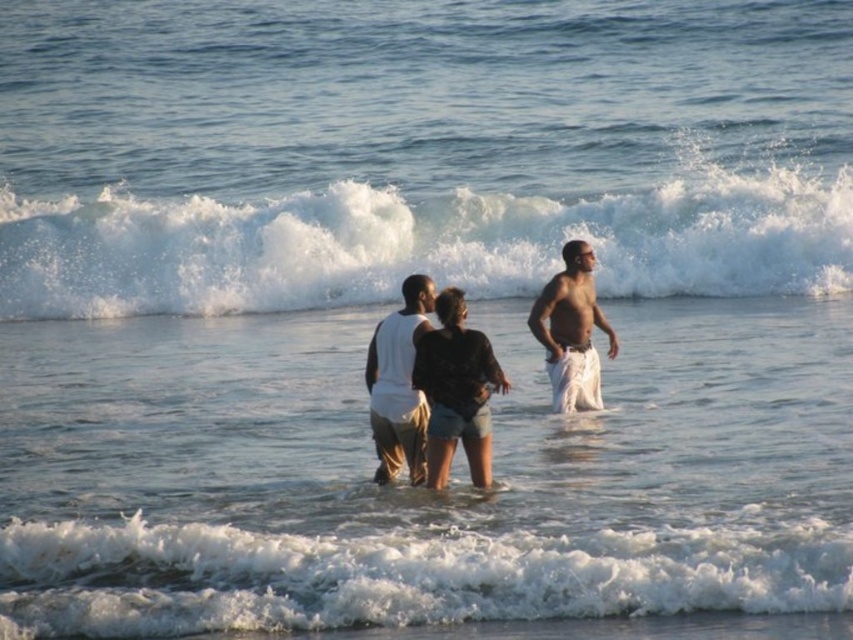
Is white frothy wave at lower center bigger than dark gray denim shorts at center?

Indeed, white frothy wave at lower center has a larger size compared to dark gray denim shorts at center.

Does white frothy wave at lower center appear under dark gray denim shorts at center?

Yes, white frothy wave at lower center is below dark gray denim shorts at center.

Is point (685, 536) in front of point (483, 404)?

Yes, it is in front of point (483, 404).

Image resolution: width=853 pixels, height=640 pixels. Identify the location of white frothy wave at lower center. (402, 576).

Between point (27, 580) and point (592, 392), which one is positioned behind?

The point (592, 392) is more distant.

What do you see at coordinates (402, 576) in the screenshot? I see `white frothy wave at lower center` at bounding box center [402, 576].

The image size is (853, 640). I want to click on white frothy wave at lower center, so click(402, 576).

Locate an element on the screen. The width and height of the screenshot is (853, 640). white frothy wave at upper center is located at coordinates click(x=421, y=243).

Does point (810, 228) come closer to viewer compared to point (428, 404)?

No, it is behind (428, 404).

Find the location of `white frothy wave at upper center`. white frothy wave at upper center is located at coordinates (421, 243).

This screenshot has height=640, width=853. I want to click on white frothy wave at upper center, so tap(421, 243).